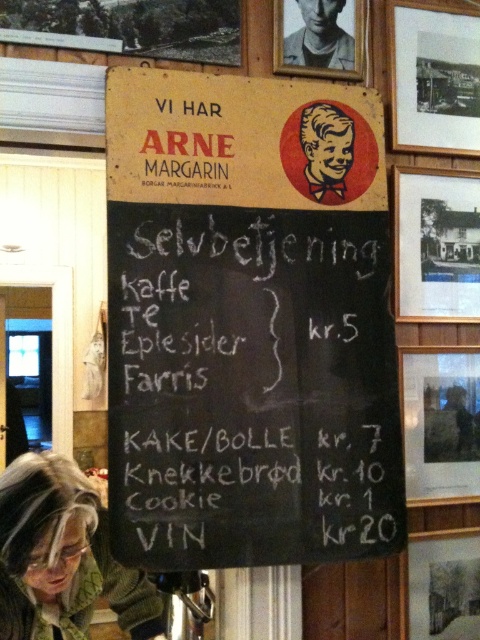
Question: Observing the image, what is the correct spatial positioning of gray knit sweater at lower left in reference to red paper boy at upper center?

Choices:
 (A) left
 (B) right

Answer: (A)

Question: Which object is positioned closest to the red paper boy at upper center?

Choices:
 (A) wooden framed photo at upper right
 (B) wooden picture frame at lower right
 (C) black matte picture frame at upper right
 (D) gray knit sweater at lower left

Answer: (A)

Question: Which object is the farthest from the wooden picture frame at lower right?

Choices:
 (A) black matte picture frame at upper right
 (B) wooden framed photo at upper right
 (C) wooden frame at upper right
 (D) red paper boy at upper center

Answer: (B)

Question: Is black matte picture frame at upper right wider than wooden picture frame at lower right?

Choices:
 (A) no
 (B) yes

Answer: (B)

Question: Which point is closer to the camera?

Choices:
 (A) (403, 19)
 (B) (432, 241)
 (C) (309, 108)

Answer: (C)

Question: Does wooden picture frame at upper center appear on the left side of red paper boy at upper center?

Choices:
 (A) no
 (B) yes

Answer: (B)